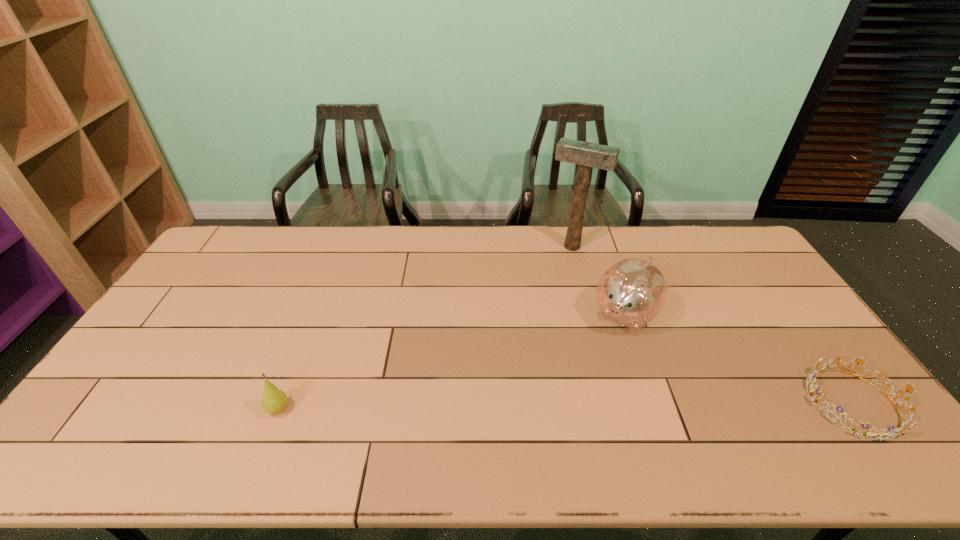
Where is `vacant space on the desktop that is between the pear and the shortest object and is positioned on the front facing side of the second farthest object`? vacant space on the desktop that is between the pear and the shortest object and is positioned on the front facing side of the second farthest object is located at coordinates (556, 406).

You are a GUI agent. You are given a task and a screenshot of the screen. Output one action in this format:
    pyautogui.click(x=<x>, y=<y>)
    Task: Click on the vacant space on the desktop that is between the pear and the tiara and is positioned on the striking surface of the mallet
    The width and height of the screenshot is (960, 540).
    Given the screenshot: What is the action you would take?
    pyautogui.click(x=490, y=407)